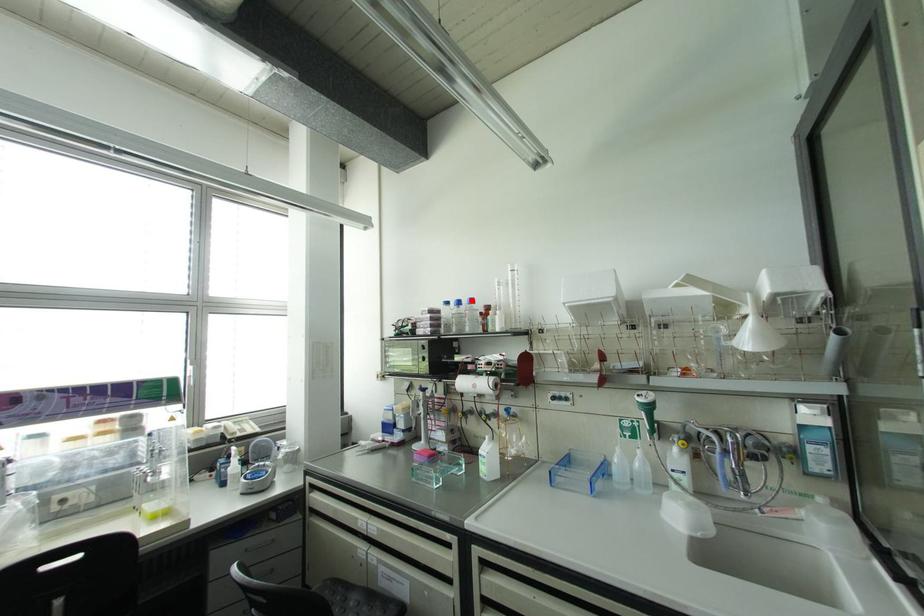
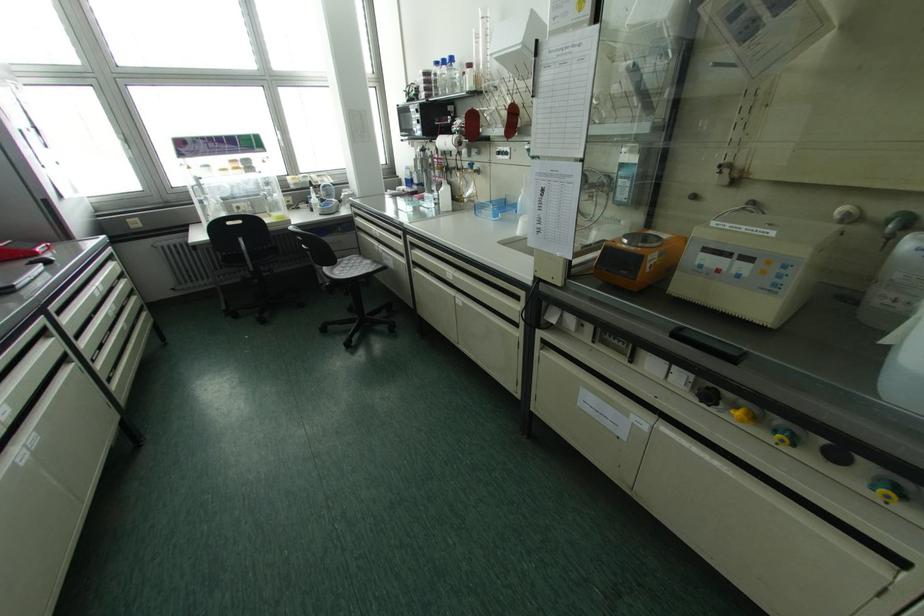
The point at the highlighted location is marked in the first image. Where is the corresponding point in the second image?

(451, 59)